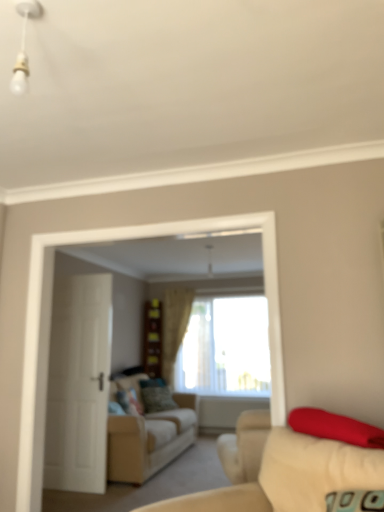
Question: Can you confirm if velvet green pillow at center, which is the second pillow from front to back, is wider than matte red pillow at right, arranged as the 1th pillow when viewed from the top?

Choices:
 (A) no
 (B) yes

Answer: (A)

Question: Would you consider velvet green pillow at center, the third pillow in the right-to-left sequence, to be distant from matte red pillow at right, acting as the third pillow starting from the bottom?

Choices:
 (A) no
 (B) yes

Answer: (B)

Question: Is velvet green pillow at center, the third pillow in the right-to-left sequence, with matte red pillow at right, arranged as the third pillow when viewed from the left?

Choices:
 (A) no
 (B) yes

Answer: (A)

Question: Is velvet green pillow at center, the third pillow in the right-to-left sequence, facing away from matte red pillow at right, which ranks as the third pillow in back-to-front order?

Choices:
 (A) yes
 (B) no

Answer: (B)

Question: Does velvet green pillow at center, which is the second pillow from front to back, have a larger size compared to matte red pillow at right, acting as the third pillow starting from the bottom?

Choices:
 (A) no
 (B) yes

Answer: (B)

Question: From a real-world perspective, is velvet green pillow at center, which ranks as the first pillow in left-to-right order, physically above matte red pillow at right, arranged as the third pillow when viewed from the left?

Choices:
 (A) yes
 (B) no

Answer: (B)

Question: Does velvet red pillow at center, the second pillow from the left, turn towards beige fabric curtain at center?

Choices:
 (A) yes
 (B) no

Answer: (B)

Question: Considering the relative sizes of velvet red pillow at center, which is counted as the 1th pillow, starting from the bottom, and beige fabric curtain at center in the image provided, is velvet red pillow at center, which is counted as the 1th pillow, starting from the bottom, wider than beige fabric curtain at center?

Choices:
 (A) yes
 (B) no

Answer: (A)

Question: Is velvet red pillow at center, which is the 2th pillow from right to left, positioned before beige fabric curtain at center?

Choices:
 (A) no
 (B) yes

Answer: (B)

Question: Considering the relative sizes of velvet red pillow at center, the second pillow from the left, and beige fabric curtain at center in the image provided, is velvet red pillow at center, the second pillow from the left, taller than beige fabric curtain at center?

Choices:
 (A) no
 (B) yes

Answer: (A)

Question: Considering the relative sizes of velvet red pillow at center, which appears as the third pillow when viewed from the front, and beige fabric curtain at center in the image provided, is velvet red pillow at center, which appears as the third pillow when viewed from the front, thinner than beige fabric curtain at center?

Choices:
 (A) yes
 (B) no

Answer: (B)

Question: Considering the relative positions of velvet red pillow at center, which is the 2th pillow from right to left, and beige fabric curtain at center in the image provided, is velvet red pillow at center, which is the 2th pillow from right to left, to the left of beige fabric curtain at center from the viewer's perspective?

Choices:
 (A) yes
 (B) no

Answer: (A)

Question: Is white glossy bulb at upper left at the left side of velvet green pillow at center, placed as the 2th pillow when sorted from top to bottom?

Choices:
 (A) no
 (B) yes

Answer: (A)